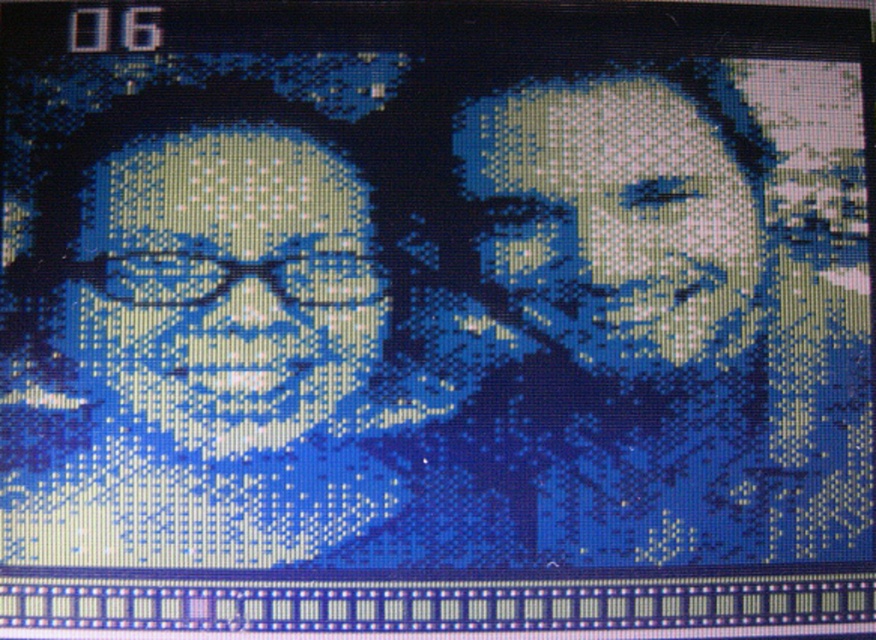
You are navigating through a digital map and need to determine the order of two points based on their depth. The points are labeled as point (x=726, y=333) and point (x=152, y=200). Which point is closer to you?

Point (x=726, y=333) is further to the viewer than point (x=152, y=200), so the closer point is point (x=152, y=200).

You are a character in a video game and need to determine the order of the matte blue face at right and matte blue face at left from your perspective. Which one is closer to you?

The matte blue face at left is behind matte blue face at right, so the matte blue face at right is closer to you.